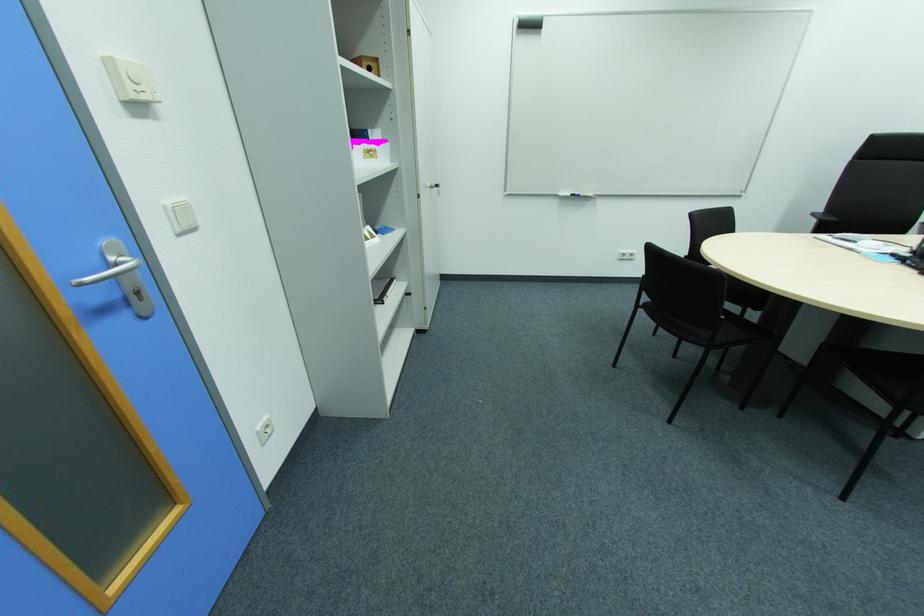
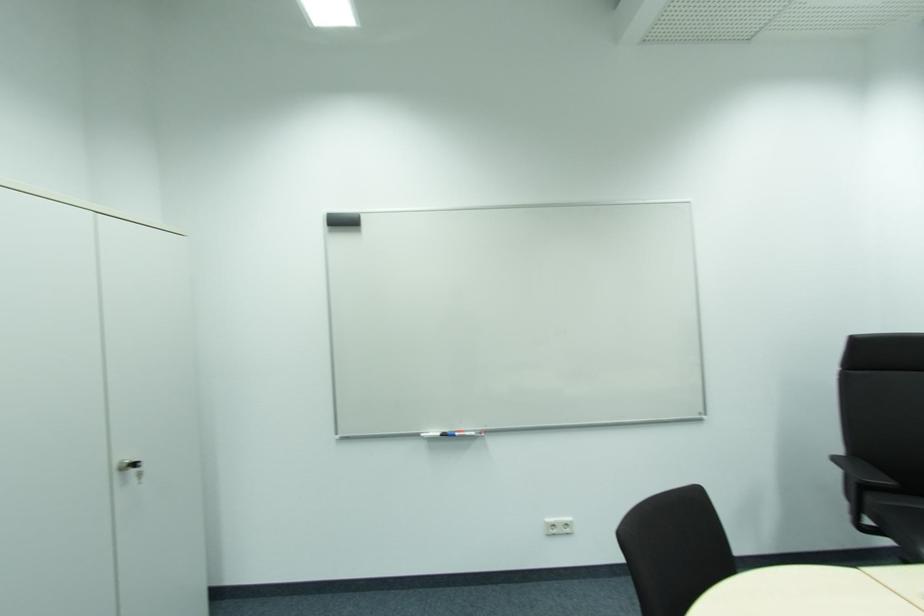
Find the pixel in the second image that matches pixel 638 254 in the first image.

(572, 524)